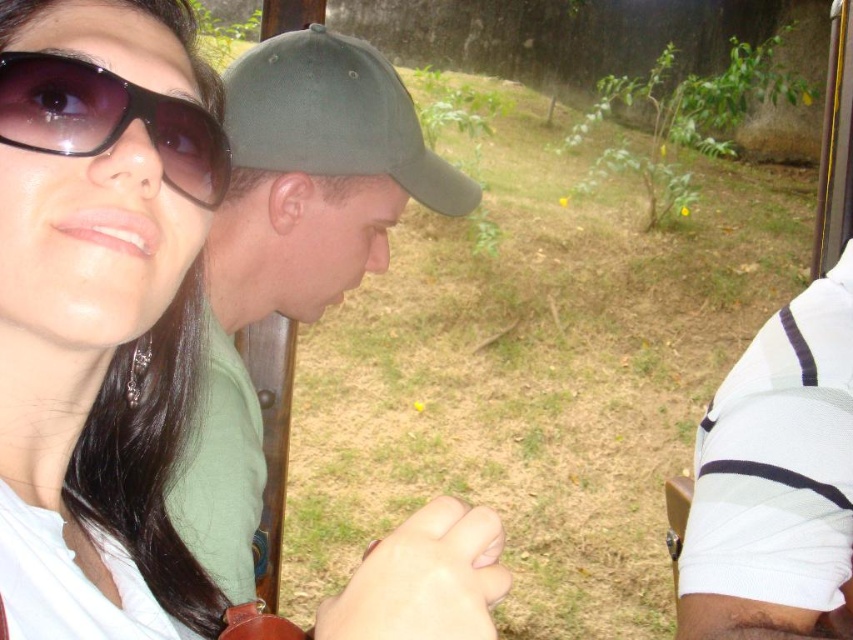
You are a photographer trying to capture a group photo of the green matte cap at center and the white striped shirt at right. If you want to ensure both subjects are fully visible in the frame, which subject should you position closer to the camera to avoid cropping?

The green matte cap at center has a lesser width compared to the white striped shirt at right. To ensure both are fully visible, position the green matte cap at center closer to the camera since it is narrower and requires less space in the frame.

You are a photographer trying to capture a closeup of the green matte cap at center and the white striped shirt at right. Since you want both subjects in focus, you need to know if they are the same size in the frame. Are they the same size?

The green matte cap at center is bigger than white striped shirt at right, so they are not the same size. Adjust your focus accordingly.

You are a photographer trying to capture a photo of the green matte cap at center and the matte black sunglasses at upper left. Since you want both subjects in focus, you need to know if they are at the same height. Are they?

The green matte cap at center is above matte black sunglasses at upper left, so they are not at the same height.